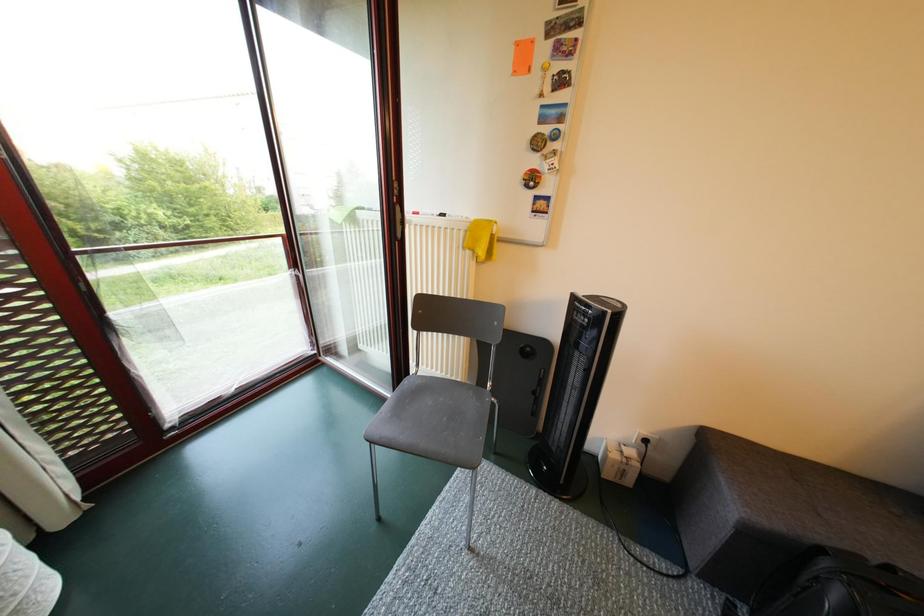
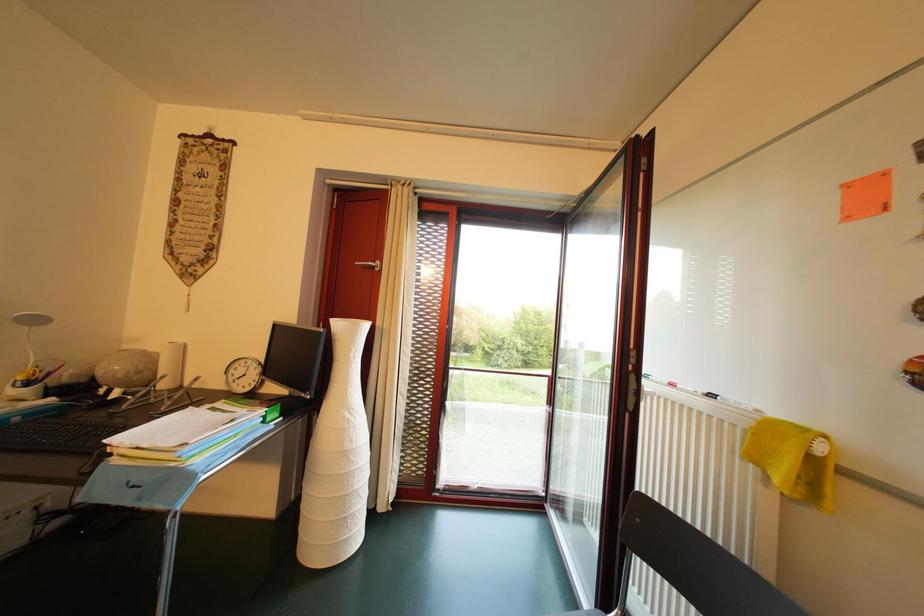
Question: The camera is either moving clockwise (left) or counter-clockwise (right) around the object. The first image is from the beginning of the video and the second image is from the end. Is the camera moving left or right when shooting the video?

Choices:
 (A) Left
 (B) Right

Answer: (B)